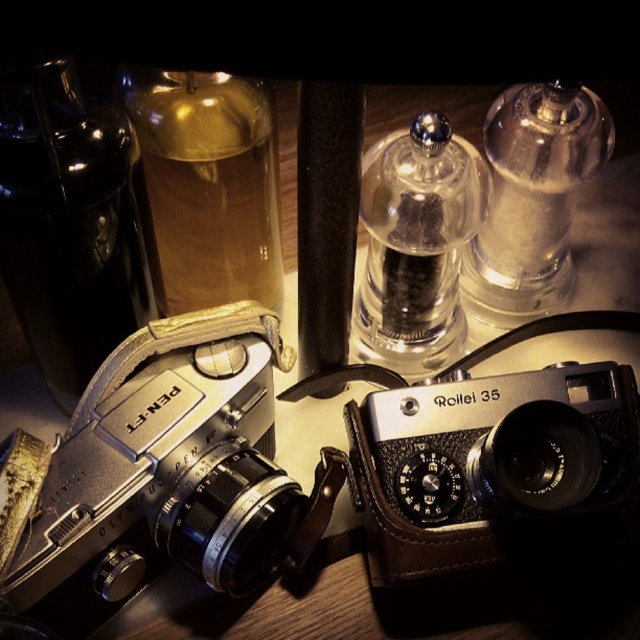
Question: Estimate the real-world distances between objects in this image. Which object is farther from the translucent glass bottle at upper left?

Choices:
 (A) matte black camera at center
 (B) silver metallic camera at left
 (C) transparent glass pepper shaker at center

Answer: (A)

Question: Does silver metallic camera at left have a lesser width compared to black glass bottle at left?

Choices:
 (A) no
 (B) yes

Answer: (A)

Question: Is silver metallic camera at left further to the viewer compared to translucent glass bottle at upper left?

Choices:
 (A) yes
 (B) no

Answer: (B)

Question: Which object appears farthest from the camera in this image?

Choices:
 (A) matte black camera at center
 (B) silver metallic camera at left

Answer: (A)

Question: Which of the following is the farthest from the observer?

Choices:
 (A) silver metallic camera at left
 (B) black glass bottle at left
 (C) transparent glass pepper shaker at center
 (D) matte black camera at center

Answer: (C)

Question: Does black glass bottle at left have a greater width compared to translucent glass bottle at upper left?

Choices:
 (A) no
 (B) yes

Answer: (A)